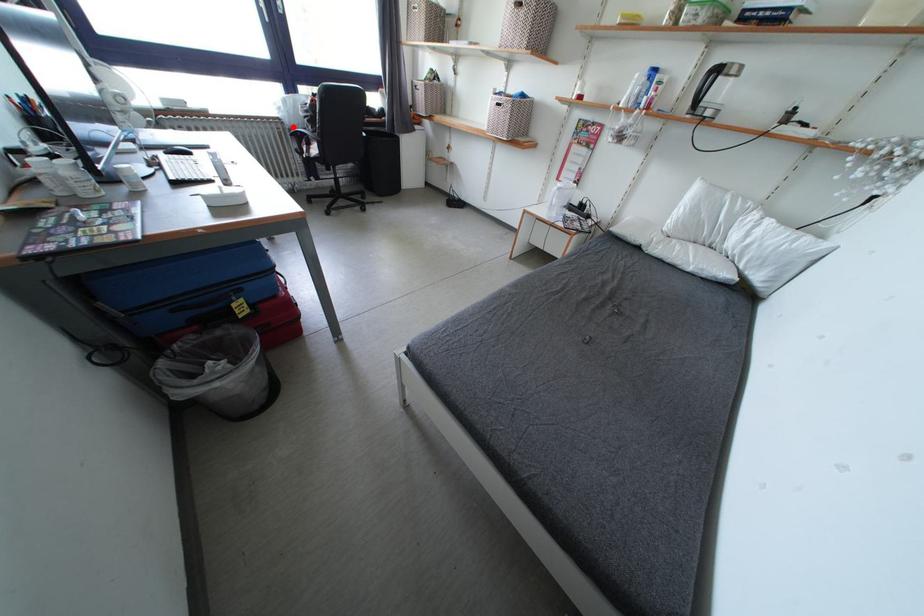
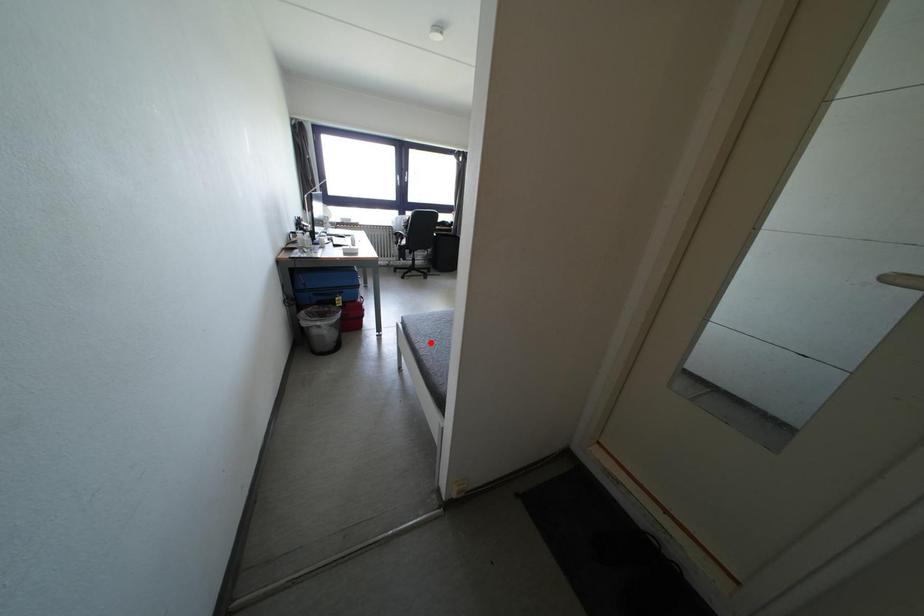
I am providing you with two images of the same scene from different viewpoints. A red point is marked on the first image and another point is marked on the second image. Are the points marked in image1 and image2 representing the same 3D position?

No